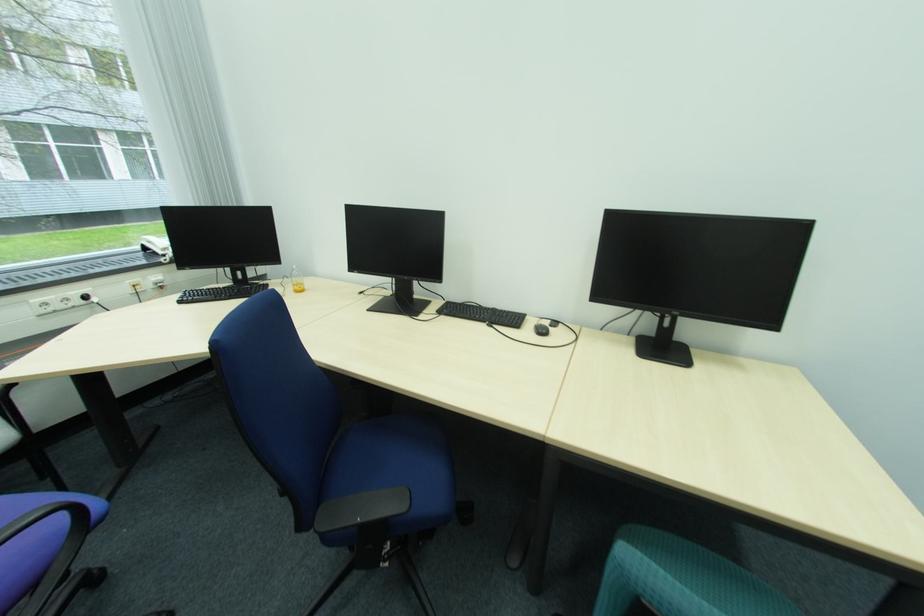
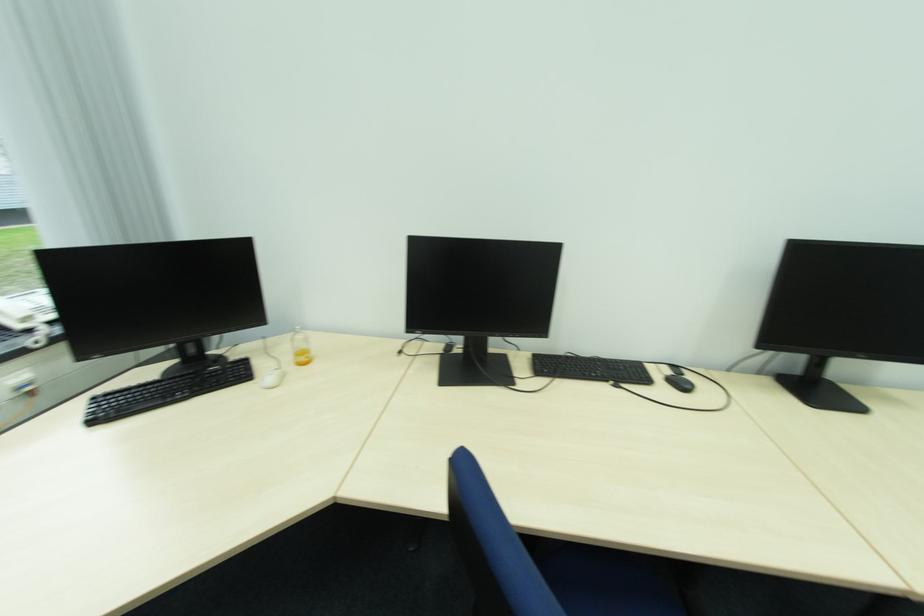
Question: The camera is either moving clockwise (left) or counter-clockwise (right) around the object. The first image is from the beginning of the video and the second image is from the end. Is the camera moving left or right when shooting the video?

Choices:
 (A) Left
 (B) Right

Answer: (A)